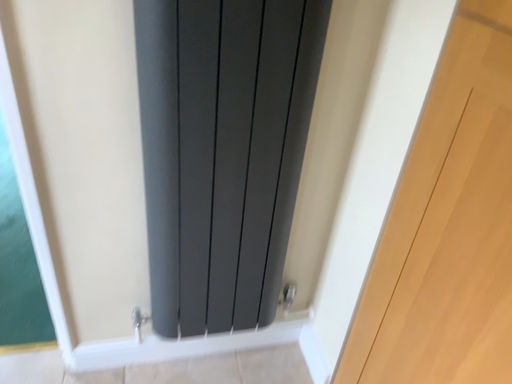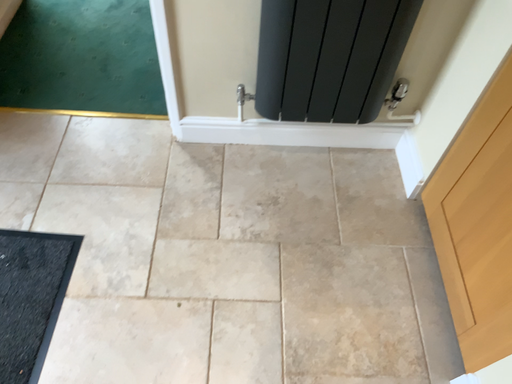
Question: Which way did the camera rotate in the video?

Choices:
 (A) rotated left
 (B) rotated right

Answer: (A)